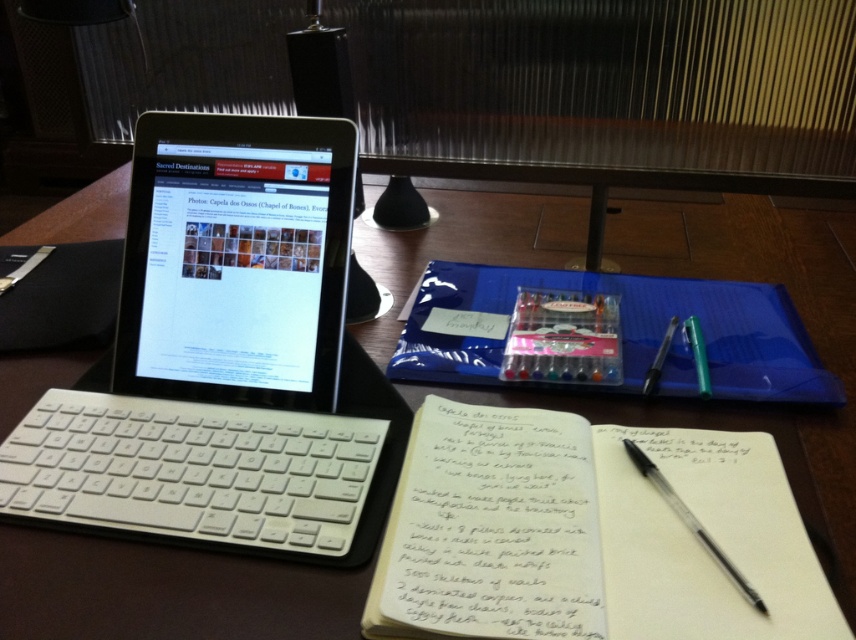
Question: Among these points, which one is nearest to the camera?

Choices:
 (A) (655, 467)
 (B) (669, 340)
 (C) (507, 301)

Answer: (A)

Question: Which of the following is the farthest from the observer?

Choices:
 (A) (663, 480)
 (B) (199, 308)

Answer: (B)

Question: Is white plastic keyboard at lower left to the left of black plastic pen at lower right from the viewer's perspective?

Choices:
 (A) yes
 (B) no

Answer: (A)

Question: Does white paper notebook at center lie in front of green plastic pen at center right?

Choices:
 (A) no
 (B) yes

Answer: (B)

Question: Can you confirm if white plastic tablet at upper left is thinner than green plastic pen at center right?

Choices:
 (A) yes
 (B) no

Answer: (B)

Question: Which point is closer to the camera?

Choices:
 (A) (395, 628)
 (B) (226, 330)
 (C) (256, 202)
 (D) (467, 372)

Answer: (A)